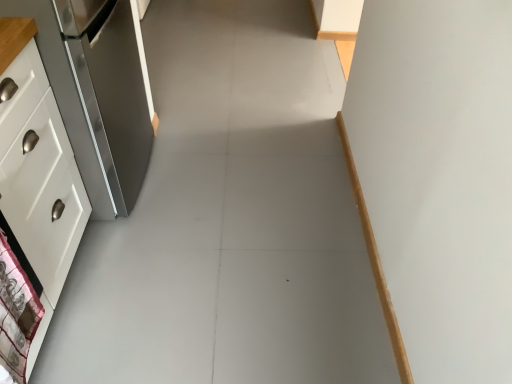
Question: Is white fabric with pattern at lower left surrounding satin silver refrigerator at left?

Choices:
 (A) no
 (B) yes

Answer: (A)

Question: From the image's perspective, is white fabric with pattern at lower left over satin silver refrigerator at left?

Choices:
 (A) yes
 (B) no

Answer: (B)

Question: Is white fabric with pattern at lower left not near satin silver refrigerator at left?

Choices:
 (A) no
 (B) yes

Answer: (A)

Question: Is white fabric with pattern at lower left wider than satin silver refrigerator at left?

Choices:
 (A) no
 (B) yes

Answer: (A)

Question: Could you tell me if white fabric with pattern at lower left is turned towards satin silver refrigerator at left?

Choices:
 (A) no
 (B) yes

Answer: (A)

Question: From the image's perspective, is white fabric with pattern at lower left below satin silver refrigerator at left?

Choices:
 (A) no
 (B) yes

Answer: (B)

Question: Does satin silver refrigerator at left turn towards white fabric with pattern at lower left?

Choices:
 (A) yes
 (B) no

Answer: (B)

Question: Is satin silver refrigerator at left further to camera compared to white fabric with pattern at lower left?

Choices:
 (A) no
 (B) yes

Answer: (B)

Question: From a real-world perspective, is satin silver refrigerator at left under white fabric with pattern at lower left?

Choices:
 (A) no
 (B) yes

Answer: (B)

Question: From the image's perspective, would you say satin silver refrigerator at left is positioned over white fabric with pattern at lower left?

Choices:
 (A) yes
 (B) no

Answer: (A)

Question: Considering the relative sizes of satin silver refrigerator at left and white fabric with pattern at lower left in the image provided, is satin silver refrigerator at left bigger than white fabric with pattern at lower left?

Choices:
 (A) no
 (B) yes

Answer: (B)

Question: From the image's perspective, is satin silver refrigerator at left under white fabric with pattern at lower left?

Choices:
 (A) no
 (B) yes

Answer: (A)

Question: Can you confirm if white glossy cabinet at left is smaller than satin silver refrigerator at left?

Choices:
 (A) no
 (B) yes

Answer: (B)